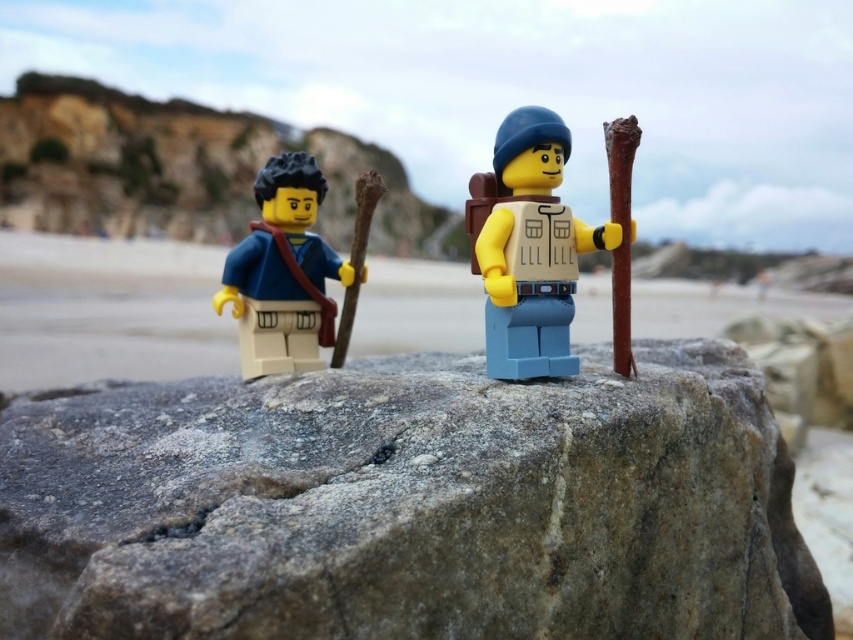
Question: Which point is farther from the camera taking this photo?

Choices:
 (A) (334, 276)
 (B) (454, 534)
 (C) (25, 332)
 (D) (491, 349)

Answer: (C)

Question: Can you confirm if gray rough rock at center is thinner than matte brown backpack at center?

Choices:
 (A) no
 (B) yes

Answer: (A)

Question: Which object is positioned farthest from the smooth sand at lower left?

Choices:
 (A) matte blue fabric backpack at left
 (B) gray rough rock at center

Answer: (B)

Question: Can you confirm if gray rough rock at center is wider than smooth sand at lower left?

Choices:
 (A) yes
 (B) no

Answer: (B)

Question: Does gray rough rock at center have a larger size compared to matte blue fabric backpack at left?

Choices:
 (A) no
 (B) yes

Answer: (B)

Question: Which object is positioned closest to the smooth sand at lower left?

Choices:
 (A) matte blue fabric backpack at left
 (B) matte brown backpack at center

Answer: (A)